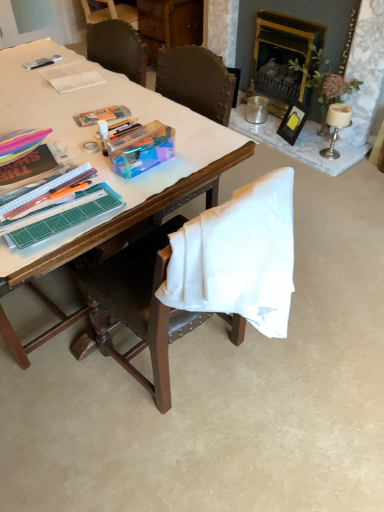
Image resolution: width=384 pixels, height=512 pixels. What are the coordinates of `free space to the left of metallic silver pen at upper left` in the screenshot? It's located at (22, 60).